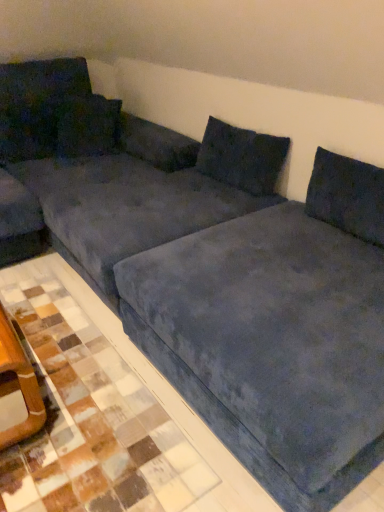
Question: From a real-world perspective, is velvet dark blue pillow at upper left, arranged as the second pillow when viewed from the right, beneath velvet dark blue pillow at upper center, the third pillow when ordered from left to right?

Choices:
 (A) no
 (B) yes

Answer: (A)

Question: Is velvet dark blue pillow at upper left, which is the second pillow in left-to-right order, taller than velvet dark blue pillow at upper center, positioned as the 1th pillow in right-to-left order?

Choices:
 (A) no
 (B) yes

Answer: (A)

Question: Does velvet dark blue pillow at upper left, arranged as the second pillow when viewed from the right, appear on the right side of velvet dark blue pillow at upper center, positioned as the 1th pillow in right-to-left order?

Choices:
 (A) yes
 (B) no

Answer: (B)

Question: Could you tell me if velvet dark blue pillow at upper left, which is the second pillow in left-to-right order, is facing velvet dark blue pillow at upper center, the third pillow when ordered from left to right?

Choices:
 (A) no
 (B) yes

Answer: (B)

Question: Does velvet dark blue pillow at upper left, which is the second pillow in left-to-right order, have a greater width compared to velvet dark blue pillow at upper center, the third pillow when ordered from left to right?

Choices:
 (A) yes
 (B) no

Answer: (A)

Question: In the image, is velvet dark blue pillow at upper left, positioned as the 1th pillow in left-to-right order, on the left side or the right side of velvet dark blue pillow at upper center, positioned as the 1th pillow in right-to-left order?

Choices:
 (A) left
 (B) right

Answer: (A)

Question: Is point (8, 155) closer or farther from the camera than point (233, 139)?

Choices:
 (A) closer
 (B) farther

Answer: (B)

Question: From the image's perspective, is velvet dark blue pillow at upper left, positioned as the 1th pillow in left-to-right order, above or below velvet dark blue pillow at upper center, positioned as the 1th pillow in right-to-left order?

Choices:
 (A) above
 (B) below

Answer: (A)

Question: Is velvet dark blue pillow at upper left, which ranks as the third pillow in right-to-left order, bigger or smaller than velvet dark blue pillow at upper center, the third pillow when ordered from left to right?

Choices:
 (A) small
 (B) big

Answer: (B)

Question: Is velvet dark blue pillow at upper center, positioned as the 1th pillow in right-to-left order, taller or shorter than velvet dark blue pillow at upper left, which is the second pillow in left-to-right order?

Choices:
 (A) tall
 (B) short

Answer: (A)

Question: Based on their sizes in the image, would you say velvet dark blue pillow at upper center, positioned as the 1th pillow in right-to-left order, is bigger or smaller than velvet dark blue pillow at upper left, arranged as the second pillow when viewed from the right?

Choices:
 (A) big
 (B) small

Answer: (B)

Question: From the image's perspective, is velvet dark blue pillow at upper center, the third pillow when ordered from left to right, positioned above or below velvet dark blue pillow at upper left, arranged as the second pillow when viewed from the right?

Choices:
 (A) below
 (B) above

Answer: (A)

Question: Considering their positions, is velvet dark blue pillow at upper center, the third pillow when ordered from left to right, located in front of or behind velvet dark blue pillow at upper left, which is the second pillow in left-to-right order?

Choices:
 (A) behind
 (B) front

Answer: (B)

Question: Is point (102, 154) positioned closer to the camera than point (0, 151)?

Choices:
 (A) closer
 (B) farther

Answer: (B)

Question: Would you say velvet dark blue pillow at upper left, which is the second pillow in left-to-right order, is inside or outside velvet dark blue pillow at upper left, positioned as the 1th pillow in left-to-right order?

Choices:
 (A) outside
 (B) inside

Answer: (B)